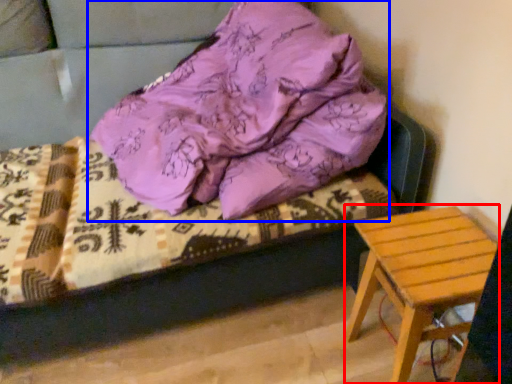
Question: Which of the following is the farthest to the observer, stool (highlighted by a red box) or pillow (highlighted by a blue box)?

Choices:
 (A) stool
 (B) pillow

Answer: (A)